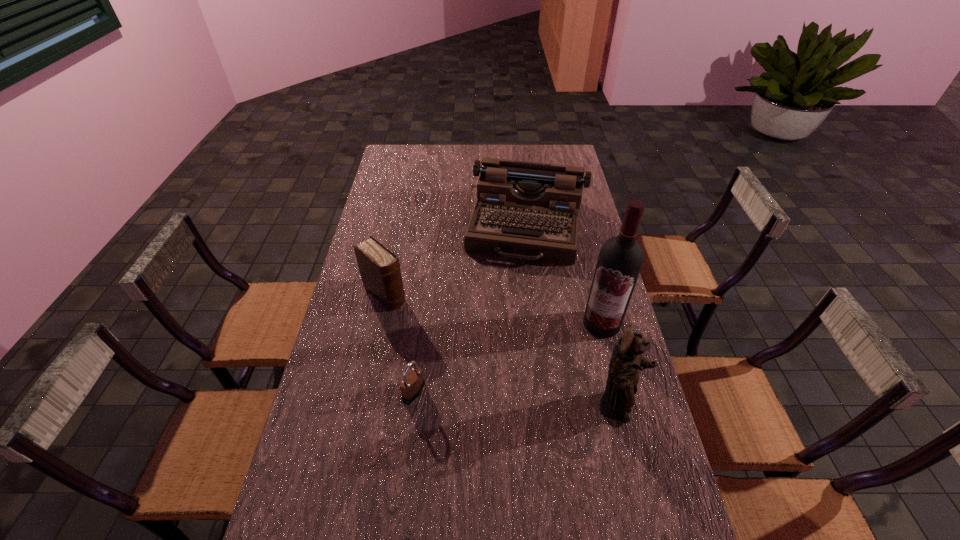
Find the location of a particular element. This screenshot has height=540, width=960. padlock is located at coordinates (413, 383).

At what (x,y) coordinates should I click in order to perform the action: click on the fourth object from right to left. Please return your answer as a coordinate pair (x, y). Looking at the image, I should click on (413, 383).

Locate an element on the screen. The height and width of the screenshot is (540, 960). figurine is located at coordinates (623, 374).

You are a GUI agent. You are given a task and a screenshot of the screen. Output one action in this format:
    pyautogui.click(x=<x>, y=<y>)
    Task: Click on the farthest object
    This screenshot has height=540, width=960.
    Given the screenshot: What is the action you would take?
    pyautogui.click(x=525, y=210)

Locate an element on the screen. diary is located at coordinates (379, 267).

Where is `the leftmost object`? This screenshot has width=960, height=540. the leftmost object is located at coordinates (379, 267).

Identify the location of wine bottle. (620, 260).

Locate an element on the screen. vacant space located 0.300m on the right of the second object from left to right is located at coordinates [533, 392].

Image resolution: width=960 pixels, height=540 pixels. What are the coordinates of `vacant space located 0.400m on the keyboard of the typewriter` in the screenshot? It's located at (502, 359).

Image resolution: width=960 pixels, height=540 pixels. Find the location of `vacant space located 0.380m on the keyboard of the typewriter`. vacant space located 0.380m on the keyboard of the typewriter is located at coordinates (503, 353).